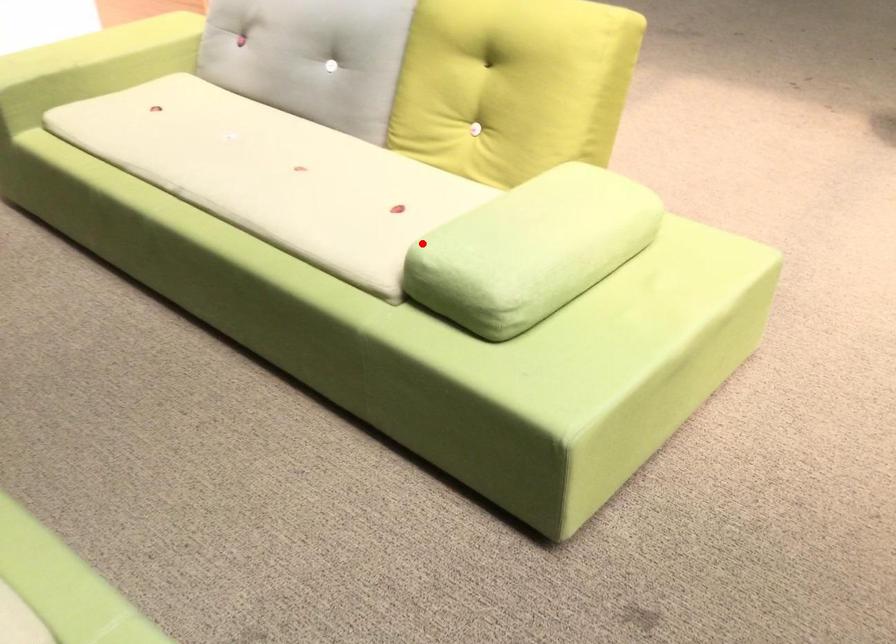
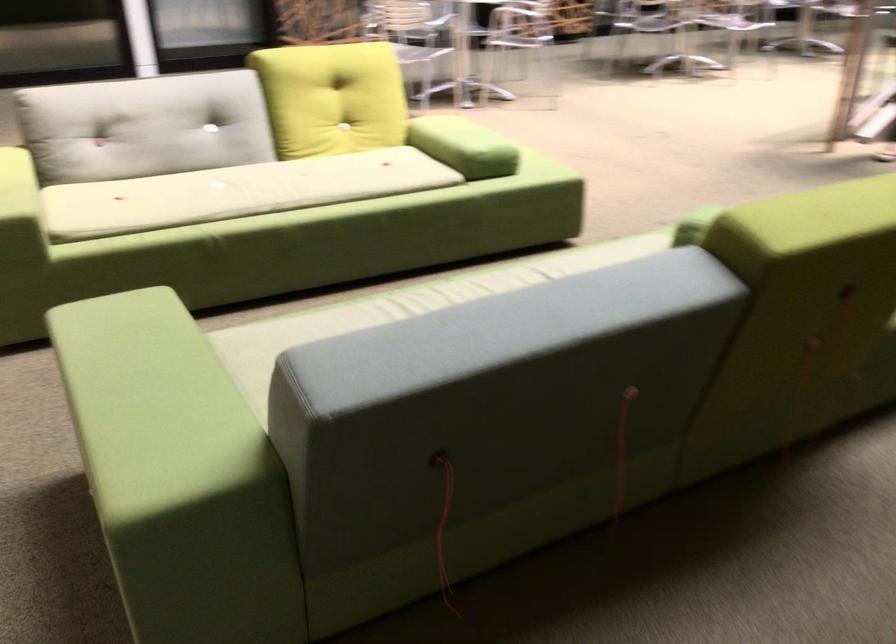
Question: I am providing you with two images of the same scene from different viewpoints. A red point is marked on the first image. Is the red point's position out of view in image 2?

Choices:
 (A) Yes
 (B) No

Answer: (B)